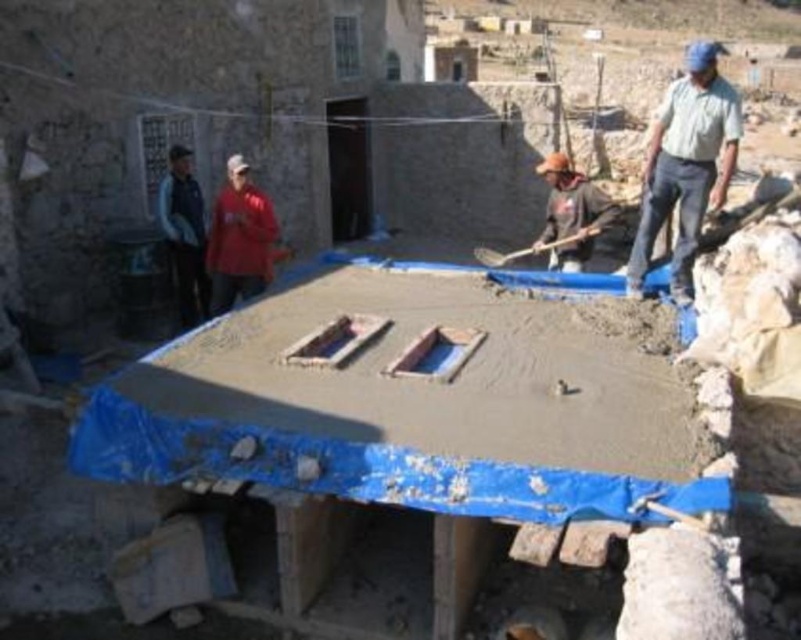
In the scene shown: Between brown fabric at center and wooden shovel at center, which one appears on the left side from the viewer's perspective?

Positioned to the left is brown fabric at center.

Is brown fabric at center above wooden shovel at center?

Indeed, brown fabric at center is positioned over wooden shovel at center.

Between point (568, 196) and point (486, 262), which one is positioned behind?

Point (486, 262)

Identify the location of brown fabric at center. The height and width of the screenshot is (640, 801). (570, 212).

Who is lower down, light blue shirt at upper right or brown fabric at center?

brown fabric at center is lower down.

Is point (689, 49) positioned after point (564, 257)?

Yes, point (689, 49) is farther from viewer.

Between point (679, 208) and point (544, 228), which one is positioned in front?

Point (679, 208) is in front.

Find the location of a particular element. The width and height of the screenshot is (801, 640). light blue shirt at upper right is located at coordinates (685, 164).

Which is in front, point (638, 291) or point (582, 230)?

Point (638, 291)

Is point (711, 125) less distant than point (590, 236)?

That is True.

Who is more forward, [662,147] or [494,253]?

Point [662,147] is more forward.

The height and width of the screenshot is (640, 801). I want to click on light blue shirt at upper right, so coord(685,164).